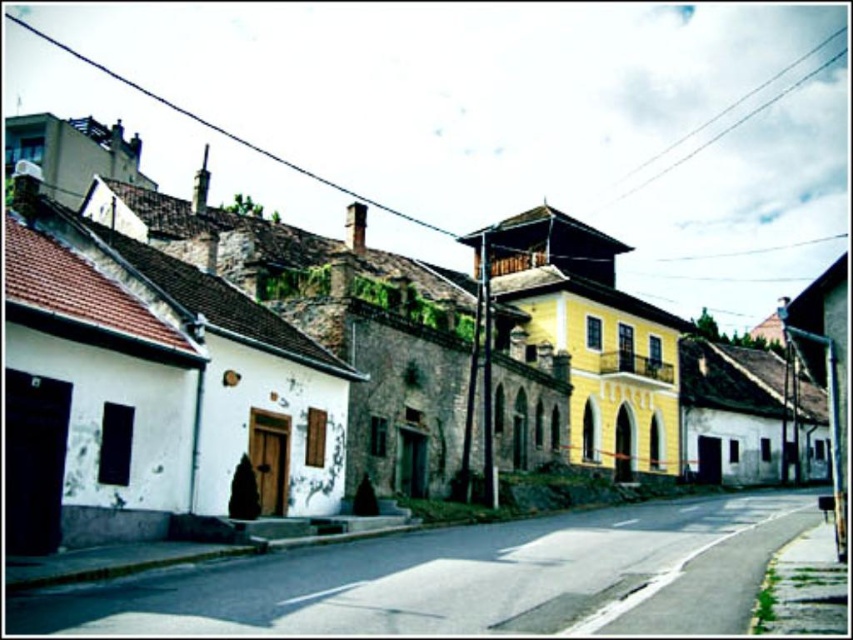
Question: Is white stone building at left below metallic pole at right?

Choices:
 (A) yes
 (B) no

Answer: (B)

Question: Which point is farther to the camera?

Choices:
 (A) metallic pole at right
 (B) white stone building at left

Answer: (A)

Question: Does white stone building at left appear under metallic pole at right?

Choices:
 (A) no
 (B) yes

Answer: (A)

Question: Can you confirm if white stone building at left is positioned to the left of metallic pole at right?

Choices:
 (A) yes
 (B) no

Answer: (A)